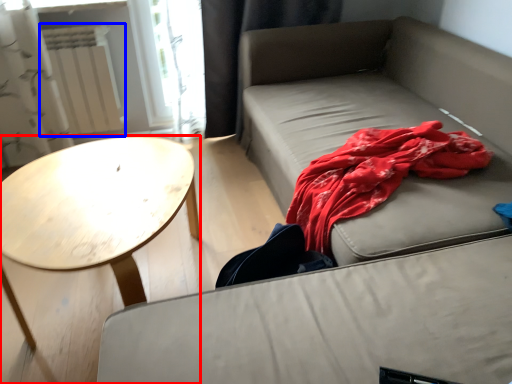
Question: Which object appears farthest to the camera in this image, coffee table (highlighted by a red box) or radiator (highlighted by a blue box)?

Choices:
 (A) coffee table
 (B) radiator

Answer: (B)